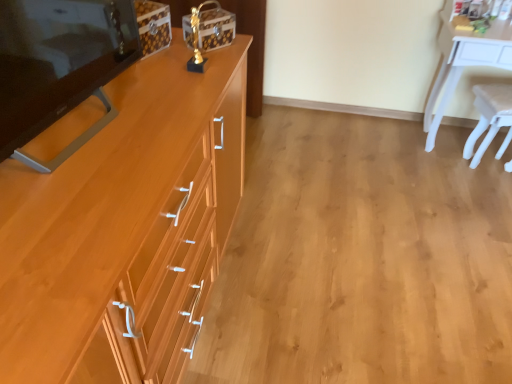
Locate an element on the screen. empty space that is ontop of wooden drawer at center-left (from a real-world perspective) is located at coordinates (378, 230).